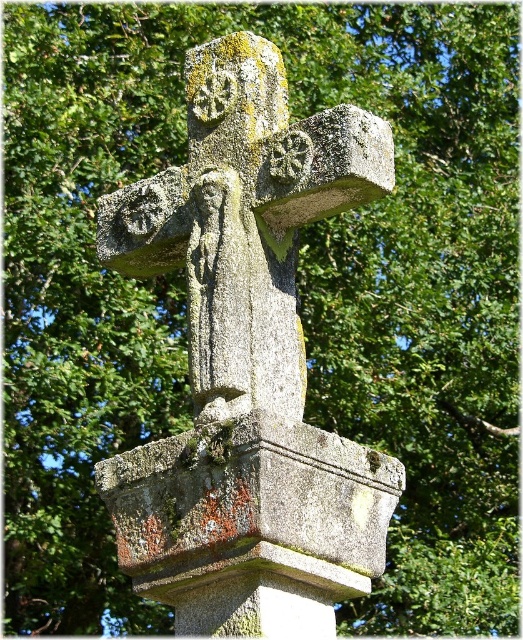
Question: Does gray stone cross at center have a greater width compared to gray stone pedestal at center?

Choices:
 (A) yes
 (B) no

Answer: (A)

Question: Is gray stone cross at center positioned at the back of gray stone pedestal at center?

Choices:
 (A) no
 (B) yes

Answer: (B)

Question: Which object is closer to the camera taking this photo?

Choices:
 (A) gray stone pedestal at center
 (B) gray stone cross at center

Answer: (A)

Question: Can you confirm if gray stone cross at center is positioned above gray stone pedestal at center?

Choices:
 (A) no
 (B) yes

Answer: (B)